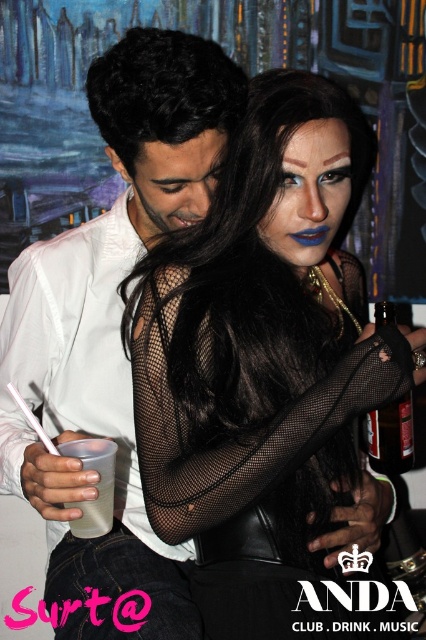
Between brown glass bottle at center right and translucent plastic cup at lower left, which one appears on the left side from the viewer's perspective?

translucent plastic cup at lower left

Between brown glass bottle at center right and translucent plastic cup at lower left, which one has less height?

Standing shorter between the two is translucent plastic cup at lower left.

The height and width of the screenshot is (640, 426). What do you see at coordinates (389, 436) in the screenshot?
I see `brown glass bottle at center right` at bounding box center [389, 436].

Identify the location of brown glass bottle at center right. This screenshot has height=640, width=426. (389, 436).

Who is more forward, (46,476) or (115,442)?

Point (46,476) is in front.

Find the location of `white matte shirt at center`. white matte shirt at center is located at coordinates (112, 332).

This screenshot has height=640, width=426. I want to click on white matte shirt at center, so click(112, 332).

Locate an element on the screen. white matte shirt at center is located at coordinates (112, 332).

Can you confirm if black fishnet gloves at center is positioned above white matte shirt at center?

Incorrect, black fishnet gloves at center is not positioned above white matte shirt at center.

Does point (305, 214) come in front of point (175, 160)?

Yes, point (305, 214) is in front of point (175, 160).

Between point (247, 160) and point (215, 99), which one is positioned in front?

Positioned in front is point (247, 160).

Find the location of a particular element. The width and height of the screenshot is (426, 640). black fishnet gloves at center is located at coordinates (265, 371).